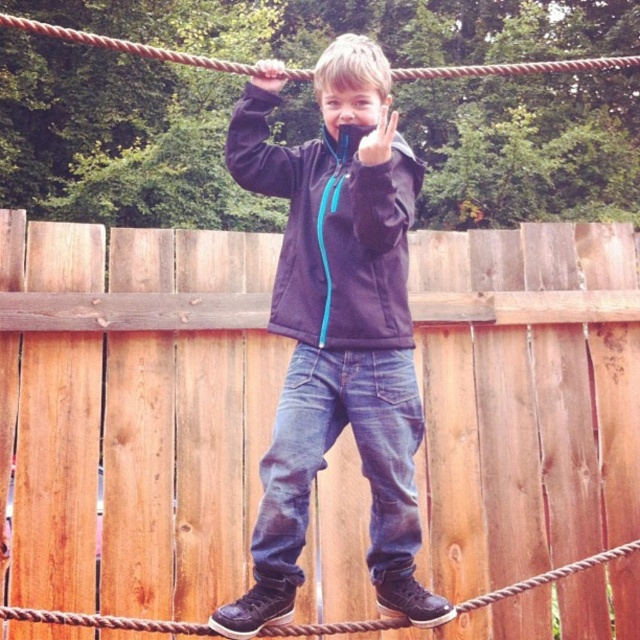
Question: Which object appears farthest from the camera in this image?

Choices:
 (A) dark blue fleece jacket at center
 (B) matte blue jacket at center

Answer: (B)

Question: Observing the image, what is the correct spatial positioning of brown rope at center in reference to brown rope at upper center?

Choices:
 (A) above
 (B) below

Answer: (B)

Question: Which point appears closest to the camera in this image?

Choices:
 (A) (410, 77)
 (B) (298, 154)

Answer: (A)

Question: Is brown wooden fence at center closer to the viewer compared to dark blue fleece jacket at center?

Choices:
 (A) yes
 (B) no

Answer: (B)

Question: Estimate the real-world distances between objects in this image. Which object is closer to the matte blue jacket at center?

Choices:
 (A) brown wooden fence at center
 (B) dark blue fleece jacket at center
 (C) brown rope at upper center

Answer: (B)

Question: In this image, where is brown wooden fence at center located relative to matte blue jacket at center?

Choices:
 (A) right
 (B) left

Answer: (A)